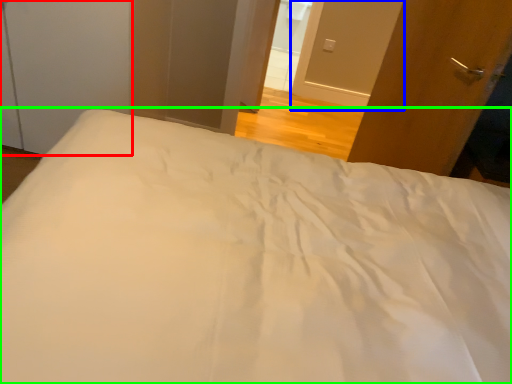
Question: Based on their relative distances, which object is nearer to screen door (highlighted by a red box)? Choose from screen door (highlighted by a blue box) and bed (highlighted by a green box).

Choices:
 (A) screen door
 (B) bed

Answer: (B)